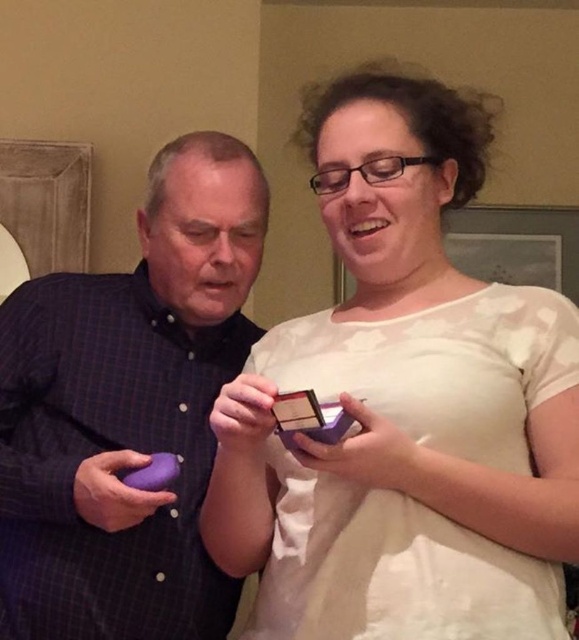
From the picture: You are organizing a gift exchange event and need to place the matte purple box at center and the purple matte phone at left on a shelf. According to the image, which object should be placed higher on the shelf?

The matte purple box at center should be placed higher on the shelf because it is positioned above the purple matte phone at left in the image.

You are standing in the center of the image. There is a point at coordinates (404, 406). What object is located at that point?

The point at coordinates (404, 406) indicates the matte purple box at center.

You are a delivery person who needs to place a package between the matte purple box at center and the purple matte phone at left. The package measures 10 inches in length. Can you fit it between them without moving either object?

The matte purple box at center and purple matte phone at left are 9.19 inches apart from each other. Since the package is 10 inches long, which is longer than the available space, it cannot be placed between them without moving either object.